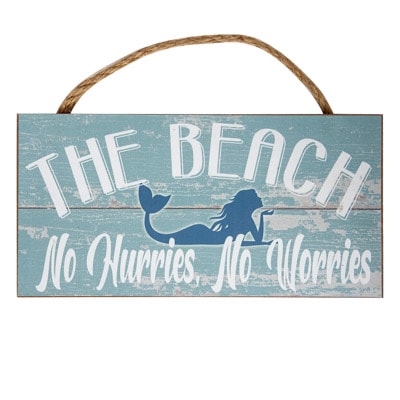
The width and height of the screenshot is (400, 400). Find the location of `cord`. cord is located at coordinates (205, 38).